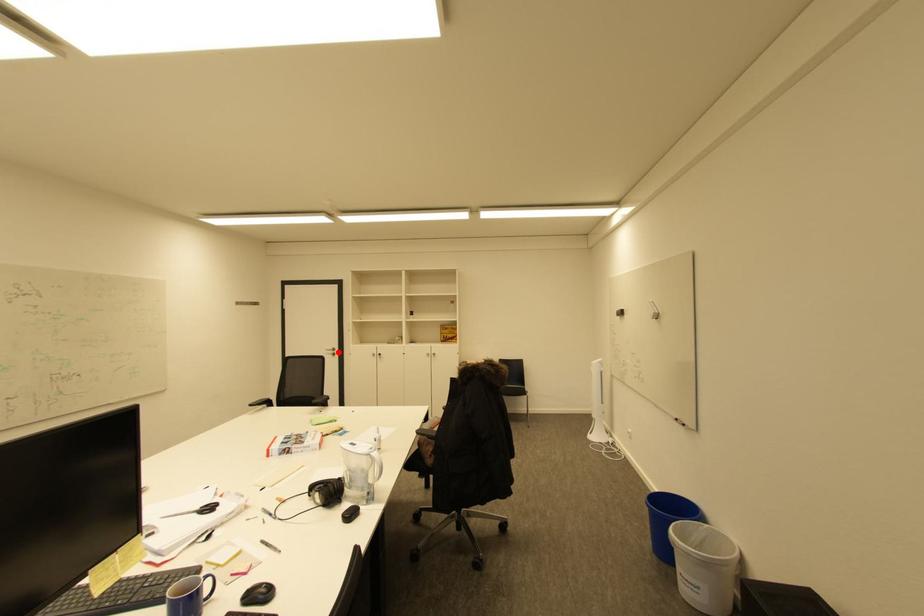
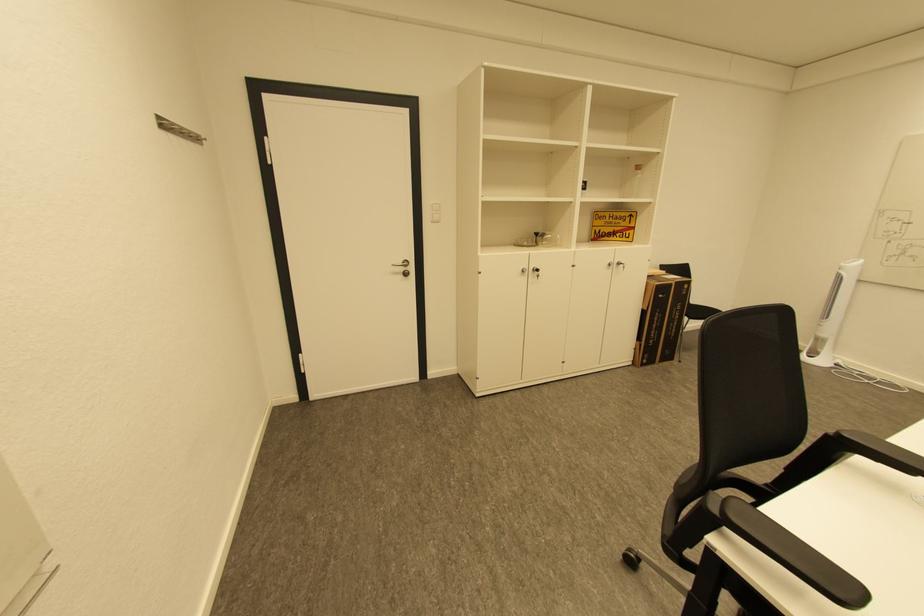
Question: I am providing you with two images of the same scene from different viewpoints. A red point is shown in image1. For the corresponding object point in image2, is it positioned nearer or farther from the camera?

Choices:
 (A) Nearer
 (B) Farther

Answer: (A)